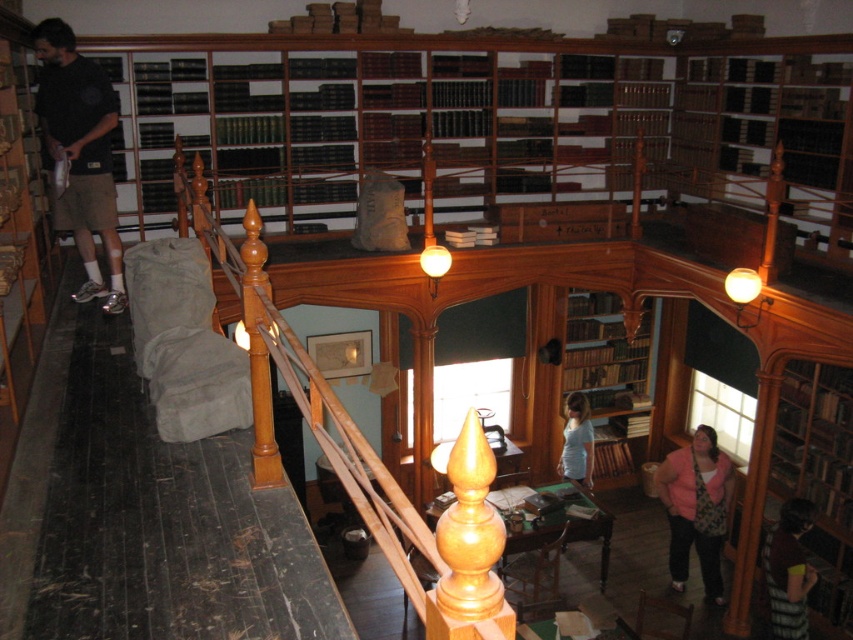
Measure the distance between matte black shirt at left and camera.

matte black shirt at left is 4.44 meters away from camera.

The height and width of the screenshot is (640, 853). What do you see at coordinates (80, 154) in the screenshot?
I see `matte black shirt at left` at bounding box center [80, 154].

At what (x,y) coordinates should I click in order to perform the action: click on matte black shirt at left. Please return your answer as a coordinate pair (x, y). Image resolution: width=853 pixels, height=640 pixels. Looking at the image, I should click on (80, 154).

Can you confirm if pink fabric at lower right is positioned to the right of striped fabric shirt at lower right?

In fact, pink fabric at lower right is to the left of striped fabric shirt at lower right.

Between point (688, 454) and point (798, 628), which one is positioned behind?

The point (688, 454) is behind.

Between point (682, 516) and point (764, 586), which one is positioned in front?

Point (764, 586) is more forward.

You are a GUI agent. You are given a task and a screenshot of the screen. Output one action in this format:
    pyautogui.click(x=<x>, y=<y>)
    Task: Click on the pink fabric at lower right
    
    Given the screenshot: What is the action you would take?
    pyautogui.click(x=695, y=506)

Does wooden bookshelf at lower right have a greater width compared to pink fabric at lower right?

Incorrect, wooden bookshelf at lower right's width does not surpass pink fabric at lower right's.

Does point (759, 461) come closer to viewer compared to point (728, 492)?

Yes, point (759, 461) is closer to viewer.

Identify the location of wooden bookshelf at lower right. The image size is (853, 640). (799, 483).